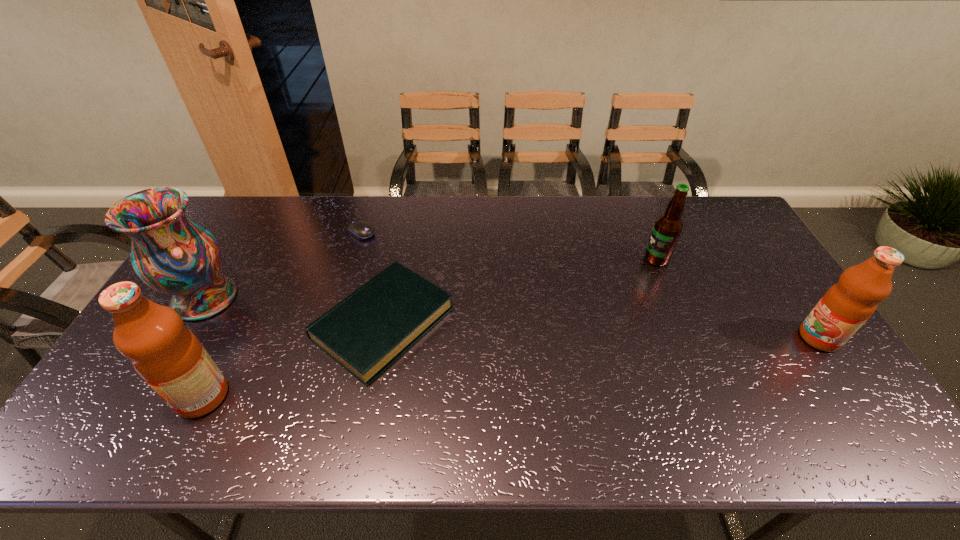
Find the location of `the taller fruit juice`. the taller fruit juice is located at coordinates (169, 357).

Find the location of `the left fruit juice`. the left fruit juice is located at coordinates (169, 357).

Locate an element on the screen. The height and width of the screenshot is (540, 960). the shorter fruit juice is located at coordinates (847, 305).

The width and height of the screenshot is (960, 540). I want to click on the right fruit juice, so click(847, 305).

This screenshot has height=540, width=960. I want to click on the farthest object, so click(x=361, y=229).

This screenshot has width=960, height=540. What are the coordinates of `computer mouse` in the screenshot? It's located at (361, 229).

What are the coordinates of `beer bottle` in the screenshot? It's located at (667, 229).

Where is `the fifth nearest object`? the fifth nearest object is located at coordinates (667, 229).

Where is `book`? book is located at coordinates (366, 332).

Identify the location of vase. (172, 254).